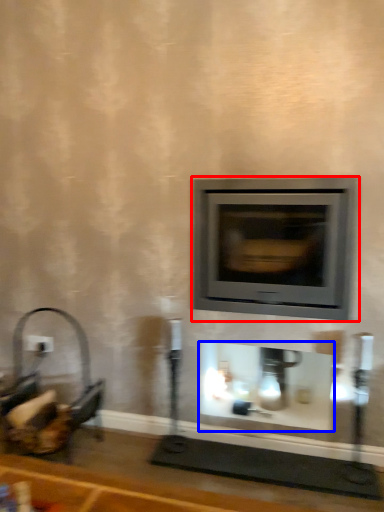
Question: Which object is further to the camera taking this photo, wood burning stove (highlighted by a red box) or fireplace (highlighted by a blue box)?

Choices:
 (A) wood burning stove
 (B) fireplace

Answer: (B)